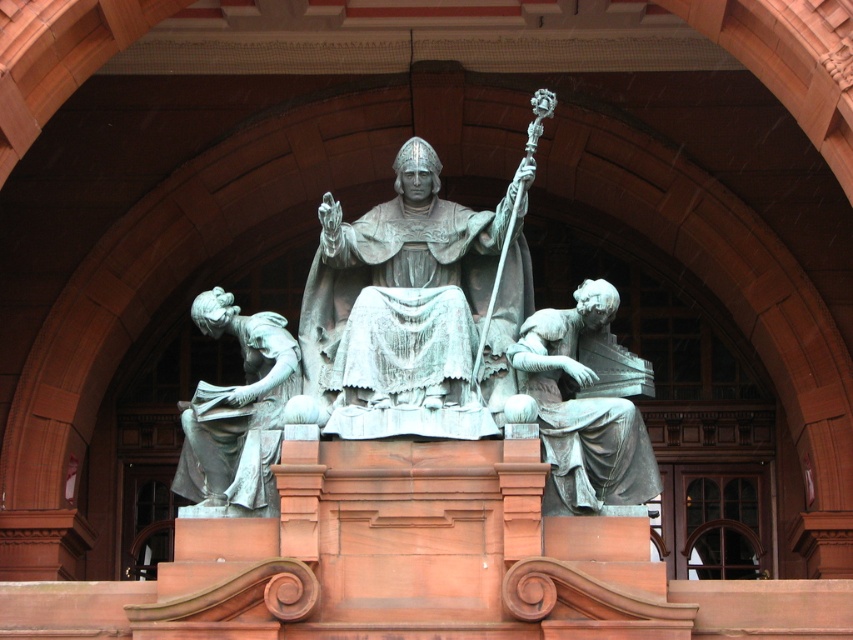
You are standing in front of the statue and want to move from the point at coordinate (421, 296) to the point at (189, 417). Which direction should you move to reach the second point?

To move from point (421, 296) to point (189, 417), you should move towards the lower right direction since the second point is located at a lower y and higher x coordinate compared to the first point.

Based on the photo, you are an art conservator examining the statue arrangement in the image. You need to determine the spatial relationship between the bronze statue at center and the green patina statue at lower right. Which statue is located to the left of the other?

The bronze statue at center is positioned on the left side of green patina statue at lower right.

You are an art conservator examining the statues in the image. You need to inspect the bronze statue at center and the green patina statue at left. Which statue should you start with to follow the correct viewing order from your current position?

The bronze statue at center should be inspected first because it is closer to the viewer than the green patina statue at left, making it the first in the viewing order.